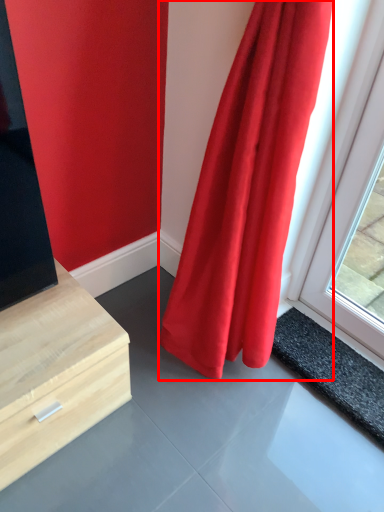
Question: From the image's perspective, where is curtain (annotated by the red box) located in relation to slate in the image?

Choices:
 (A) above
 (B) below

Answer: (A)